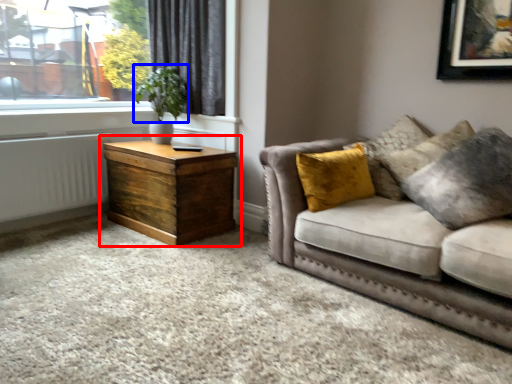
Question: Among these objects, which one is nearest to the camera, nightstand (highlighted by a red box) or plant (highlighted by a blue box)?

Choices:
 (A) nightstand
 (B) plant

Answer: (A)